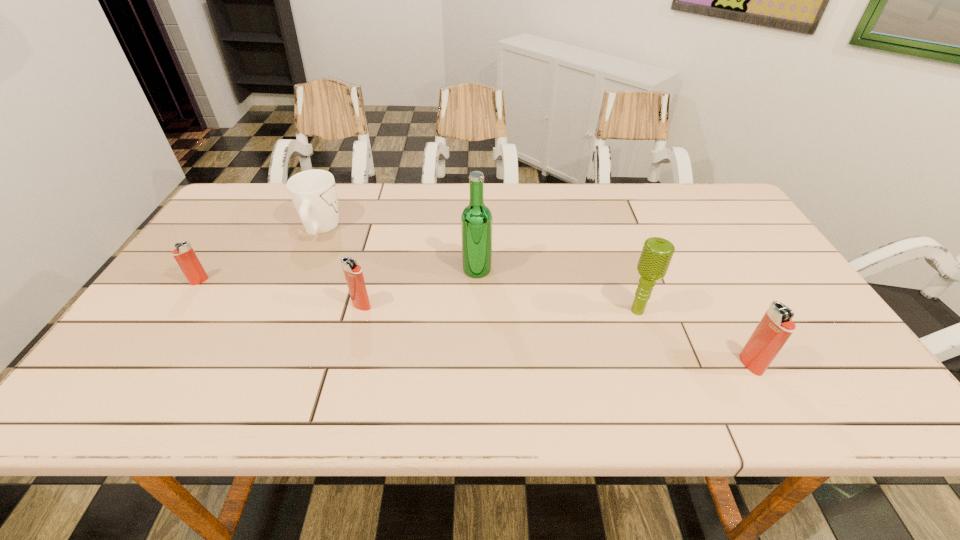
I want to click on the tallest object, so click(x=476, y=219).

In order to click on the third object from right to left in this screenshot , I will do `click(476, 219)`.

What are the coordinates of `vacant space located 0.050m on the right of the leftmost igniter` in the screenshot? It's located at (226, 281).

Identify the location of blank area located on the back of the third object from left to right. (380, 237).

This screenshot has width=960, height=540. I want to click on vacant space located 0.270m on the back of the rightmost igniter, so (x=701, y=272).

Where is `free space located 0.070m on the side of the mug with the handle`? free space located 0.070m on the side of the mug with the handle is located at coordinates (334, 200).

In order to click on free space located 0.050m on the side of the mug with the handle in this screenshot , I will do `click(332, 204)`.

Locate an element on the screen. The width and height of the screenshot is (960, 540). free space located 0.370m on the back of the microphone is located at coordinates (604, 216).

Locate an element on the screen. The width and height of the screenshot is (960, 540). free spot located 0.090m on the back of the beer bottle is located at coordinates (477, 240).

This screenshot has height=540, width=960. In order to click on object at the far edge in this screenshot , I will do `click(313, 192)`.